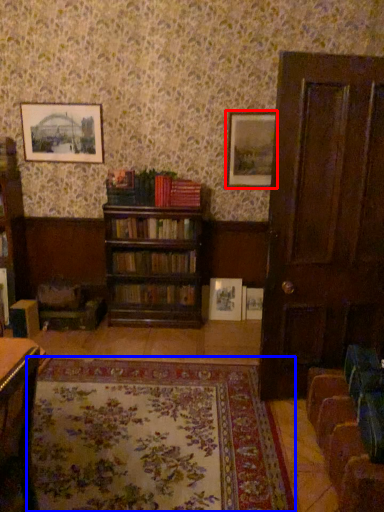
Question: Which object is closer to the camera taking this photo, picture frame (highlighted by a red box) or blanket (highlighted by a blue box)?

Choices:
 (A) picture frame
 (B) blanket

Answer: (B)